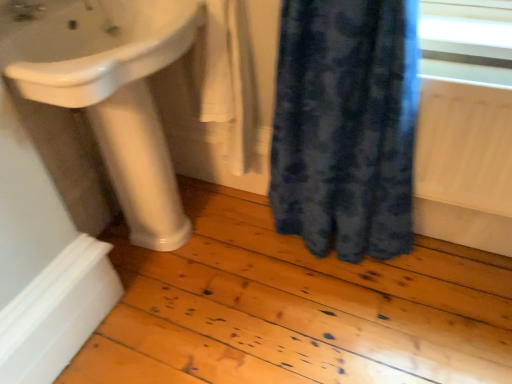
Question: Does point (384, 54) appear closer or farther from the camera than point (220, 87)?

Choices:
 (A) farther
 (B) closer

Answer: (B)

Question: From a real-world perspective, is blue textured fabric at lower right physically located above or below white cotton towel at center?

Choices:
 (A) above
 (B) below

Answer: (B)

Question: Which object is positioned closest to the white cotton towel at center?

Choices:
 (A) blue textured fabric at lower right
 (B) white glossy pedestal at lower left
 (C) white glossy sink at upper left
 (D) matte white tap at upper left

Answer: (C)

Question: Which of these objects is positioned closest to the white glossy pedestal at lower left?

Choices:
 (A) blue textured fabric at lower right
 (B) white cotton towel at center
 (C) white glossy sink at upper left
 (D) matte white tap at upper left

Answer: (C)